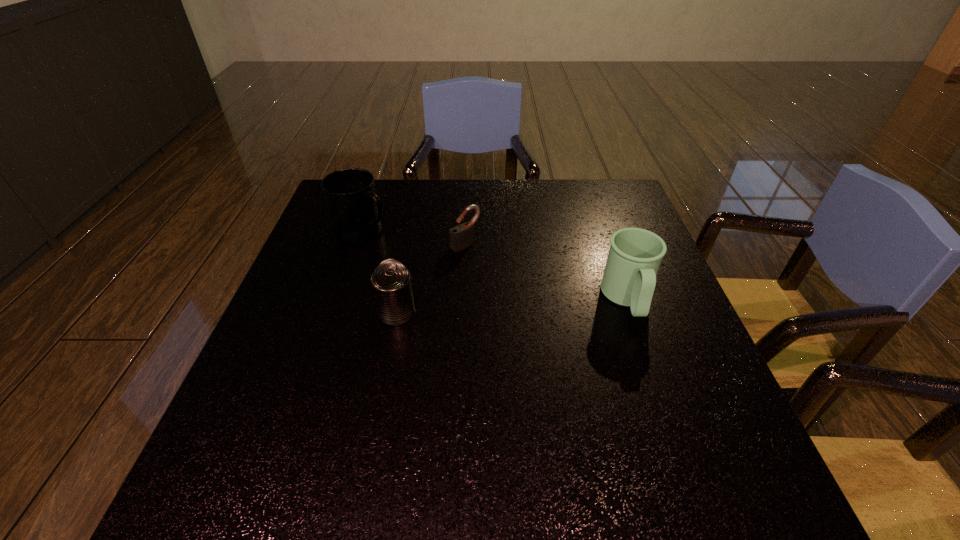
At what (x,y) coordinates should I click in order to perform the action: click on free spot between the right mug and the can. Please return your answer as a coordinate pair (x, y). The image size is (960, 540). Looking at the image, I should click on (513, 306).

Identify the location of object that is the closest to the padlock. (355, 210).

Locate an element on the screen. Image resolution: width=960 pixels, height=540 pixels. the second closest object to the nearer mug is located at coordinates (391, 282).